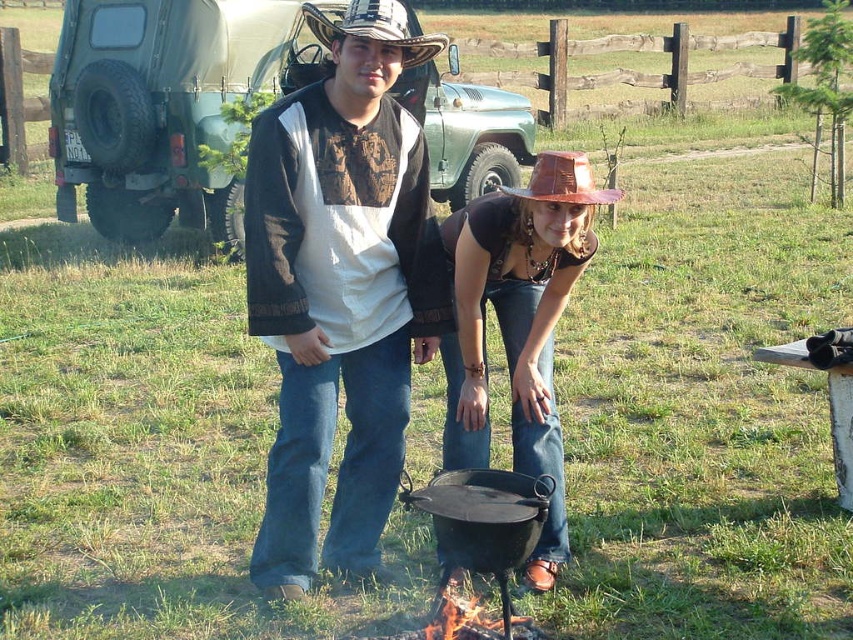
Question: Estimate the real-world distances between objects in this image. Which object is closer to the brushed metal cowboy hat at upper center?

Choices:
 (A) shiny brown hat at center
 (B) brown leather cowboy hat at center
 (C) matte black jacket at center

Answer: (B)

Question: Is matte black jacket at center to the right of brushed metal cowboy hat at upper center from the viewer's perspective?

Choices:
 (A) yes
 (B) no

Answer: (B)

Question: Does shiny brown hat at center have a larger size compared to brushed metal cowboy hat at upper center?

Choices:
 (A) no
 (B) yes

Answer: (B)

Question: Which point is farther to the camera?

Choices:
 (A) (422, 40)
 (B) (316, 33)
 (C) (556, 166)

Answer: (B)

Question: Is matte black jacket at center smaller than shiny brown hat at center?

Choices:
 (A) no
 (B) yes

Answer: (B)

Question: Which is farther from the brushed metal cowboy hat at upper center?

Choices:
 (A) brown leather cowboy hat at center
 (B) matte black jacket at center
 (C) shiny brown hat at center

Answer: (C)